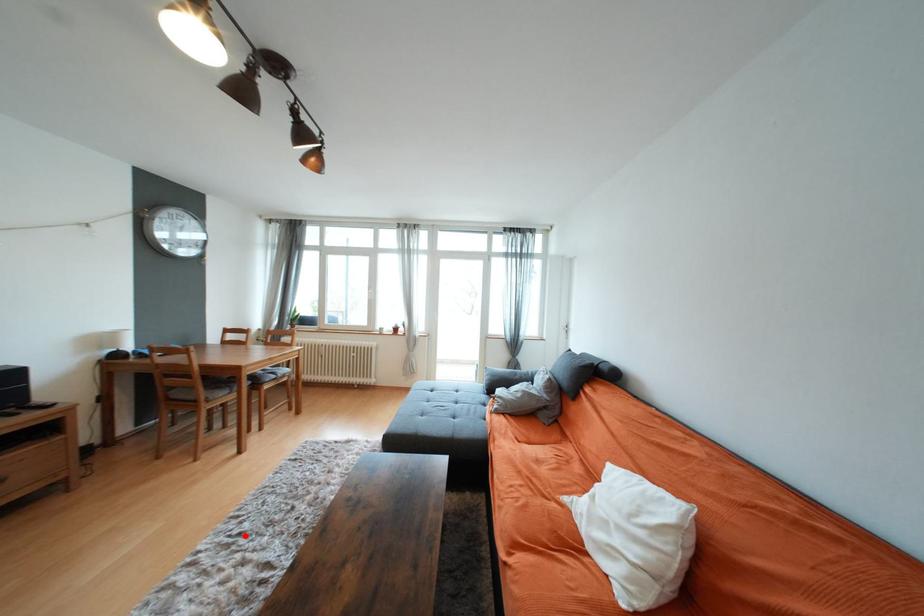
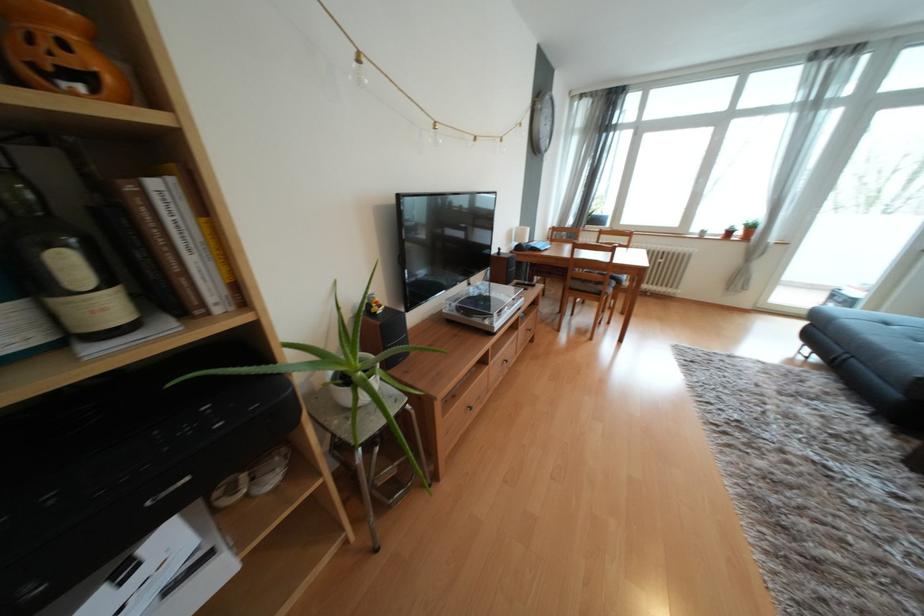
The point at the highlighted location is marked in the first image. Where is the corresponding point in the second image?

(745, 424)